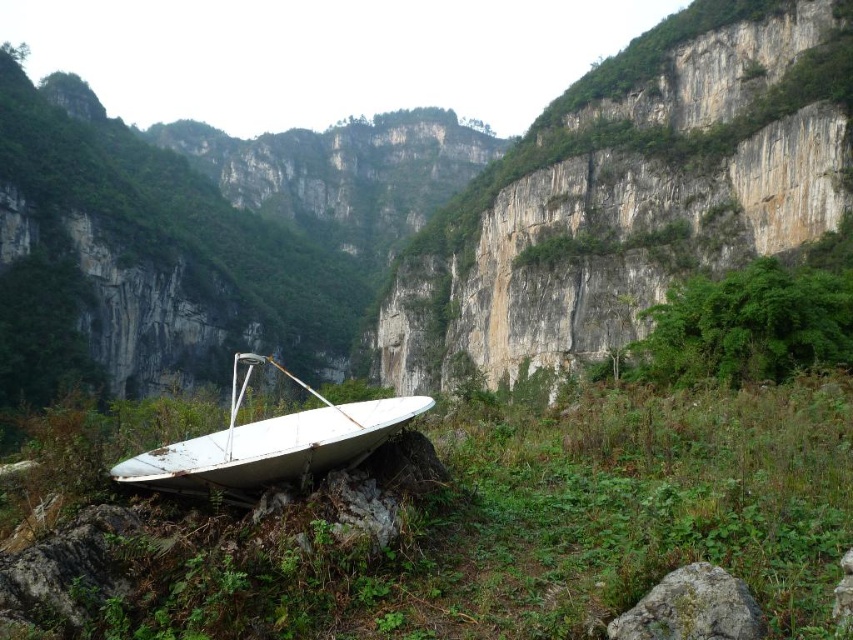
Question: Among these points, which one is nearest to the camera?

Choices:
 (A) (624, 284)
 (B) (276, 417)

Answer: (B)

Question: Considering the real-world distances, which object is closest to the rough stone cliff at center?

Choices:
 (A) gray rough rock at lower right
 (B) white matte boat at center

Answer: (B)

Question: Observing the image, what is the correct spatial positioning of white matte boat at center in reference to gray rough rock at lower right?

Choices:
 (A) right
 (B) left

Answer: (B)

Question: Does rough stone cliff at center have a greater width compared to white matte boat at center?

Choices:
 (A) no
 (B) yes

Answer: (B)

Question: Which point is closer to the camera?

Choices:
 (A) tap(303, 454)
 (B) tap(699, 616)
 (C) tap(831, 65)

Answer: (B)

Question: Is rough stone cliff at center to the right of white matte boat at center from the viewer's perspective?

Choices:
 (A) no
 (B) yes

Answer: (B)